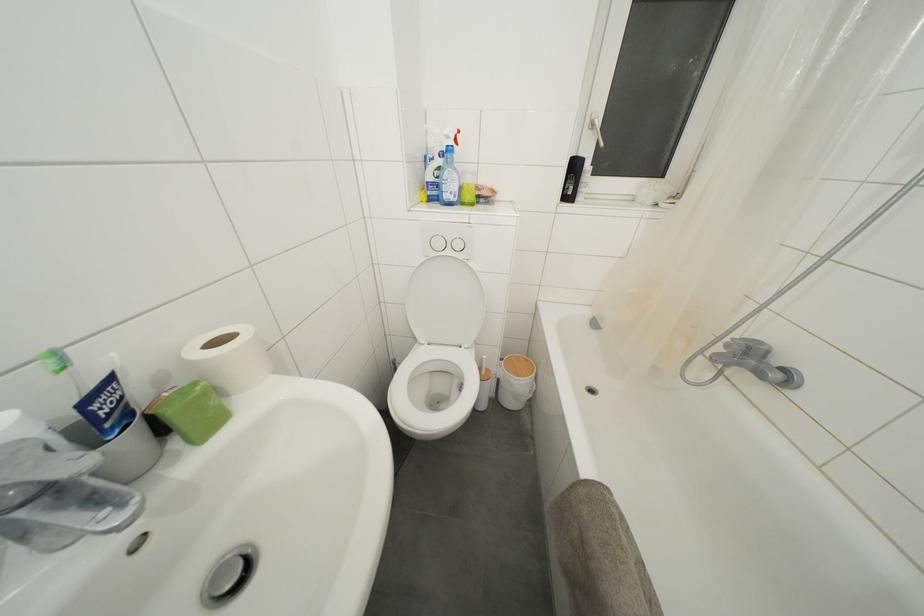
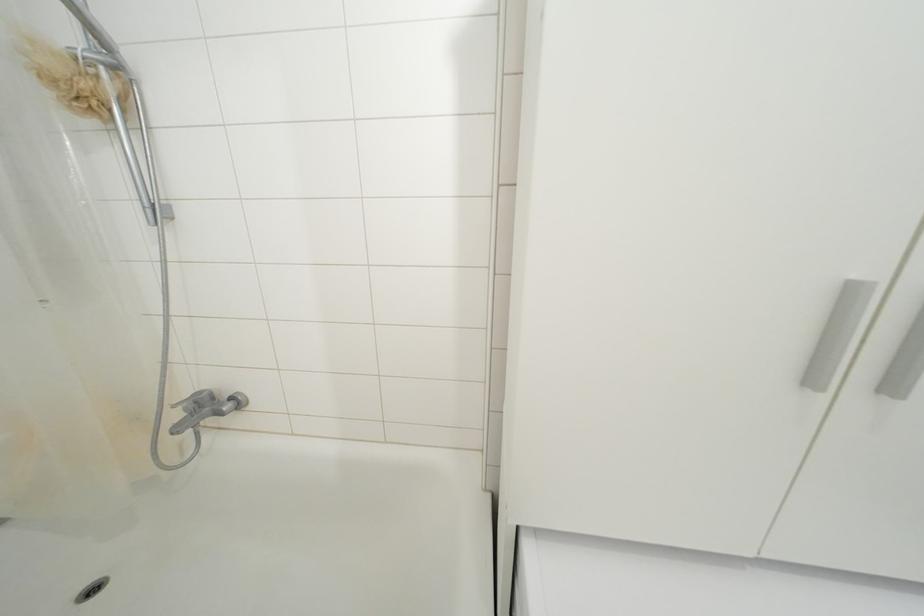
In the second image, find the point that corresponds to the point at 769,352 in the first image.

(209, 398)